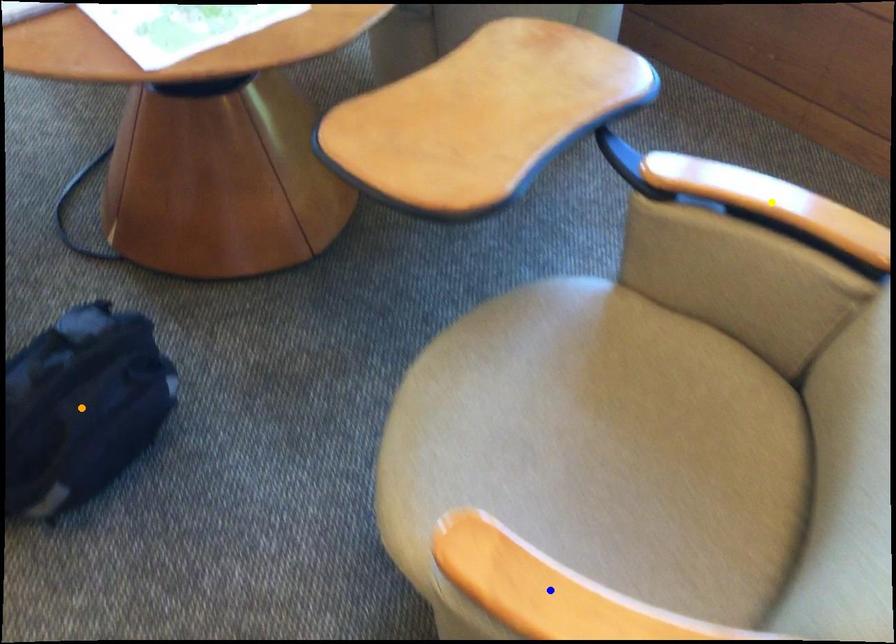
Order these from nearest to farthest:
A) orange point
B) blue point
C) yellow point

blue point
yellow point
orange point